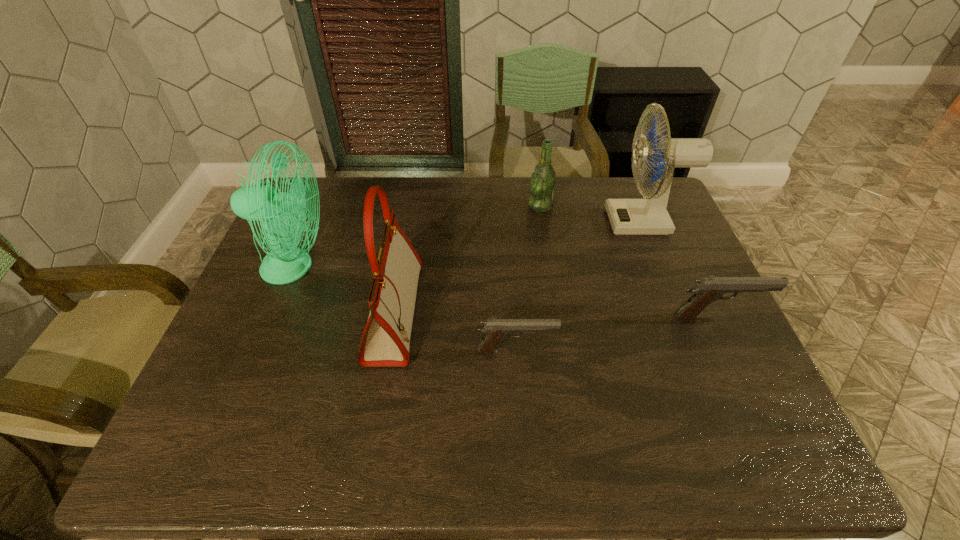
Where is `the nearer pistol`? This screenshot has width=960, height=540. the nearer pistol is located at coordinates (495, 330).

Identify the location of the shortest object. This screenshot has width=960, height=540. (495, 330).

Where is `the right pistol`? the right pistol is located at coordinates (707, 289).

Identify the location of the taller pistol. (707, 289).

Find the location of a particular element. the third shortest object is located at coordinates (543, 180).

I want to click on the right fan, so click(x=649, y=216).

The height and width of the screenshot is (540, 960). Find the location of `handbag`. handbag is located at coordinates (385, 342).

Find the location of a particular element. The height and width of the screenshot is (540, 960). the left fan is located at coordinates (282, 214).

Where is `free space located 0.140m at the barrel of the shortest object`? The image size is (960, 540). free space located 0.140m at the barrel of the shortest object is located at coordinates (613, 351).

You are a GUI agent. You are given a task and a screenshot of the screen. Output one action in this format:
    pyautogui.click(x=<x>, y=<y>)
    Task: Click on the free space located on the surface of the beer bottle
    
    Given the screenshot: What is the action you would take?
    pyautogui.click(x=440, y=206)